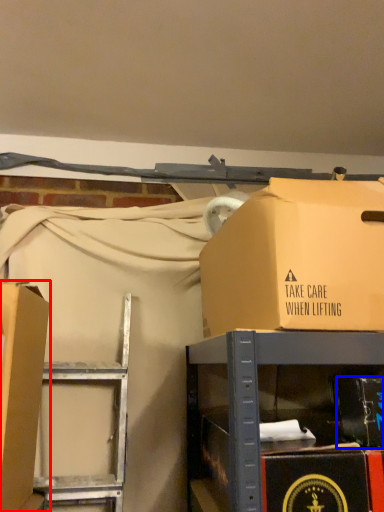
Question: Which point is further to the camera, box (highlighted by a red box) or box (highlighted by a blue box)?

Choices:
 (A) box
 (B) box

Answer: (B)